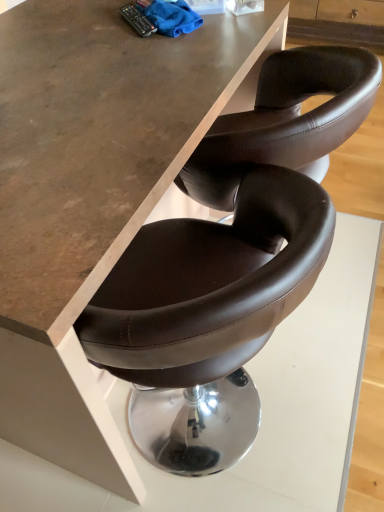
Locate an element on the screen. This screenshot has width=384, height=512. free space to the left of blue microfiber cloth at upper center is located at coordinates (102, 31).